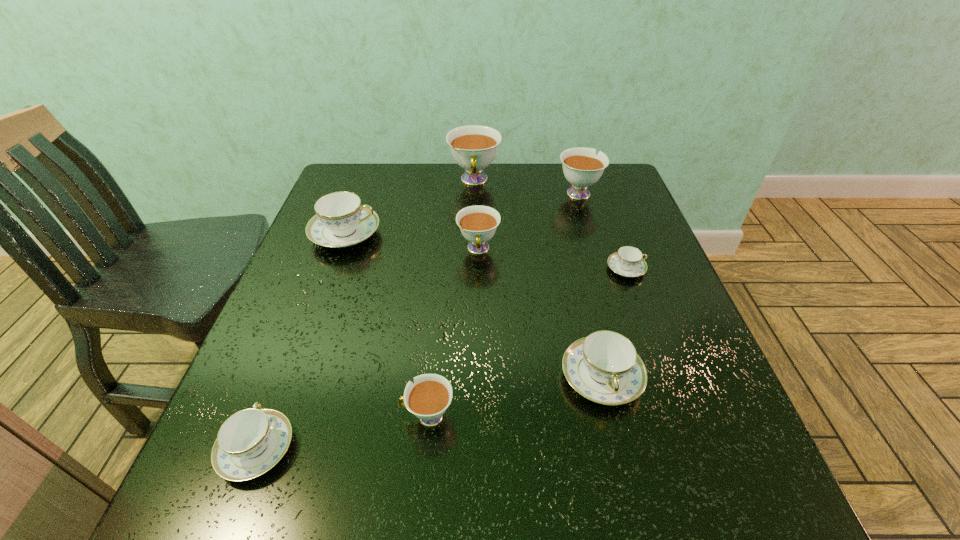
Where is `the shortest teacup`? This screenshot has width=960, height=540. the shortest teacup is located at coordinates (628, 261).

You are a GUI agent. You are given a task and a screenshot of the screen. Output one action in this format:
    pyautogui.click(x=<x>, y=<y>)
    Task: Click on the free region located 0.350m on the side of the tallest teacup with the handle
    The width and height of the screenshot is (960, 540).
    Given the screenshot: What is the action you would take?
    pyautogui.click(x=472, y=282)

Find the location of a particular element. vacant space situated 0.050m on the side of the second tallest teacup with the handle is located at coordinates (571, 170).

In order to click on vacant space located 0.110m on the side with the handle of the biggest blue teacup in this screenshot , I will do `click(423, 234)`.

You are a GUI agent. You are given a task and a screenshot of the screen. Output one action in this format:
    pyautogui.click(x=<x>, y=<y>)
    Task: Click on the vacant space located on the side of the second nearest white teacup with the handle
    The width and height of the screenshot is (960, 540).
    Given the screenshot: What is the action you would take?
    pyautogui.click(x=478, y=284)

The image size is (960, 540). What are the coordinates of `vacant space situated 0.160m on the side with the handle of the third smallest blue teacup` in the screenshot? It's located at (634, 514).

Find the location of a particular element. vacant space located on the side of the smallest white teacup with the handle is located at coordinates (320, 416).

Locate an element on the screen. The width and height of the screenshot is (960, 540). free spot located 0.170m on the side of the smallest white teacup with the handle is located at coordinates (302, 416).

Identify the location of vacant area situated on the side with the handle of the nearest blue teacup. (326, 268).

Locate an element on the screen. vacant area situated on the side with the handle of the nearest blue teacup is located at coordinates point(322,280).